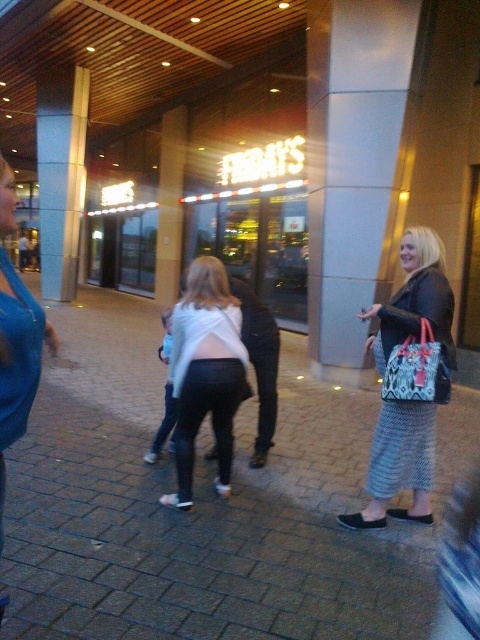
Does white fabric top at center appear under wooden pillar at center?

Yes, white fabric top at center is below wooden pillar at center.

In order to click on white fabric top at center in this screenshot , I will do `click(205, 371)`.

Measure the distance between point (432, 404) and camera.

Answer: They are 3.04 meters apart.

Who is more forward, (416, 236) or (389, 371)?

Positioned in front is point (389, 371).

Identify the location of matte black jacket at right. (398, 465).

Is point (418, 419) positioned before point (158, 292)?

Yes, it is.

In the scene shown: Measure the distance between matte black jacket at right and wooden pillar at center.

A distance of 13.32 meters exists between matte black jacket at right and wooden pillar at center.

Which is behind, point (371, 461) or point (168, 266)?

Point (168, 266)

I want to click on matte black jacket at right, so click(x=398, y=465).